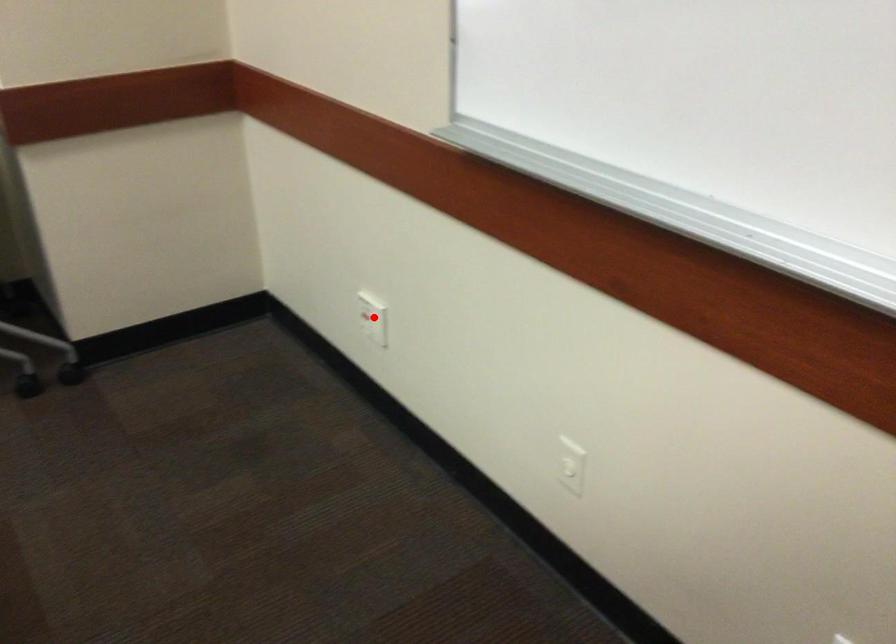
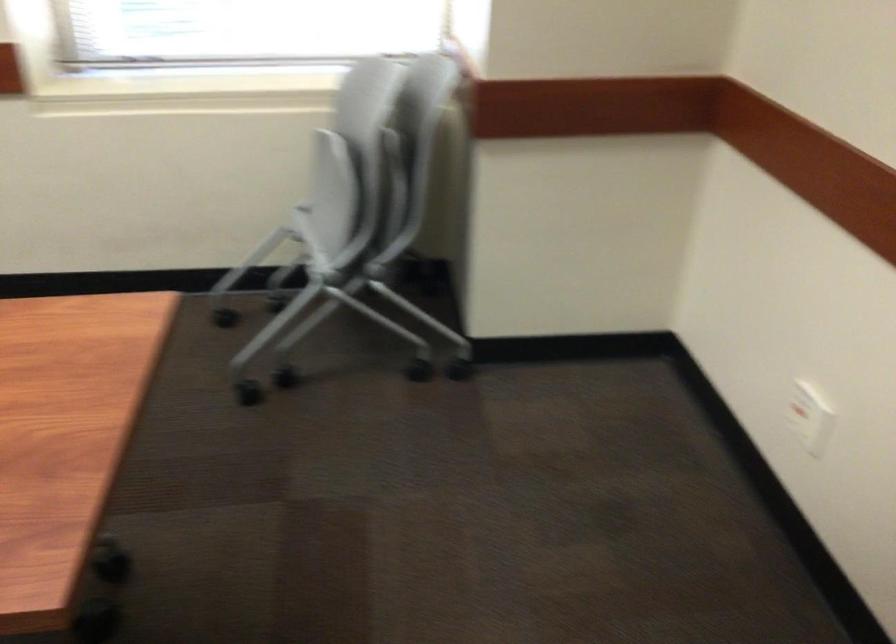
Find the pixel in the second image that matches the highlighted location in the first image.

(808, 415)